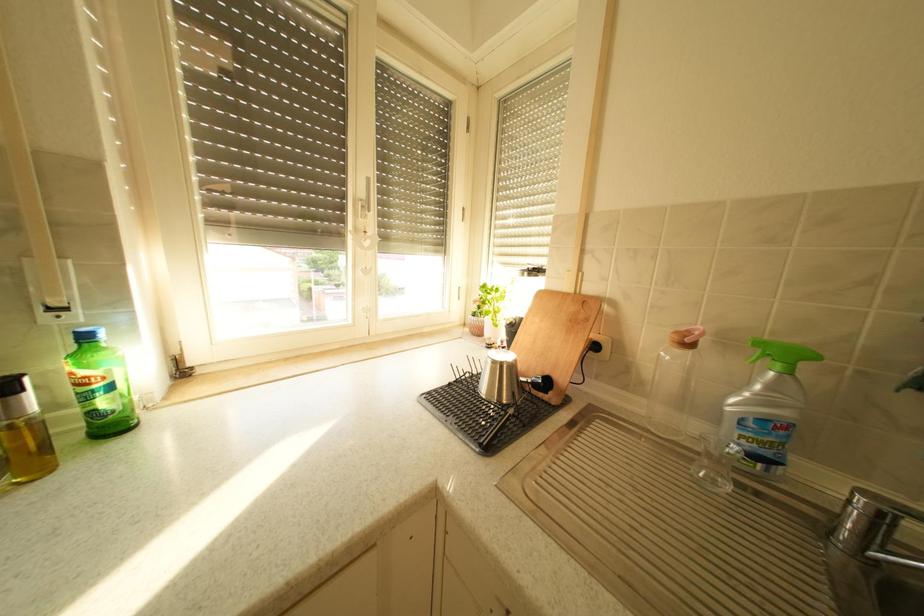
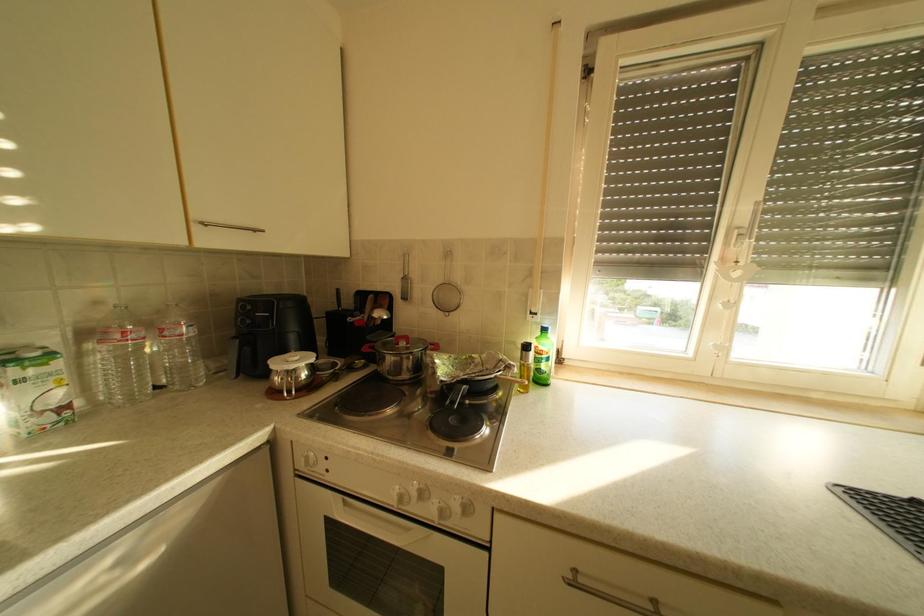
Question: The images are taken continuously from a first-person perspective. In which direction is your viewpoint rotating?

Choices:
 (A) Left
 (B) Right
 (C) Up
 (D) Down

Answer: (A)